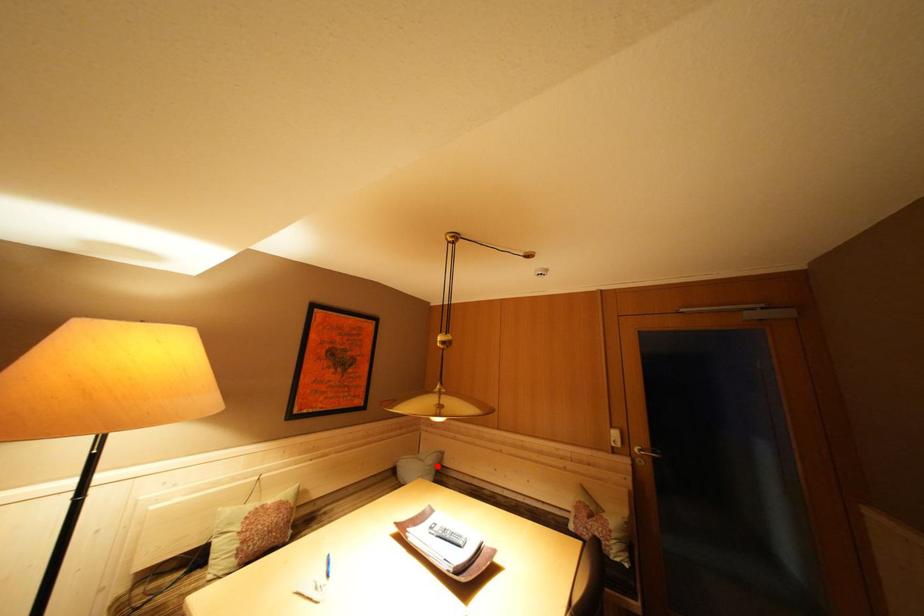
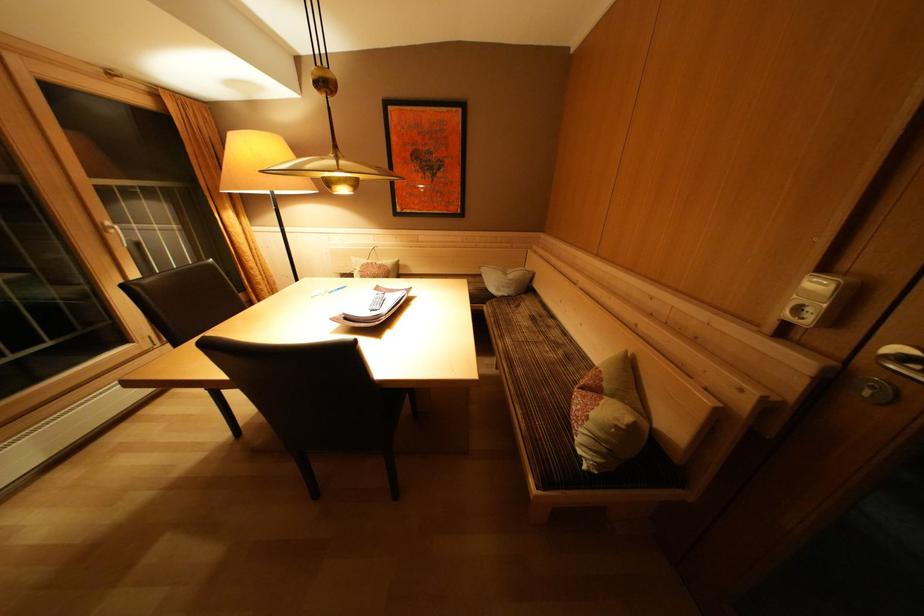
Question: A red point is marked in image1. In image2, is the corresponding 3D point closer to the camera or farther? Reply with the corresponding letter.

Choices:
 (A) The corresponding 3D point is closer.
 (B) The corresponding 3D point is farther.

Answer: (A)